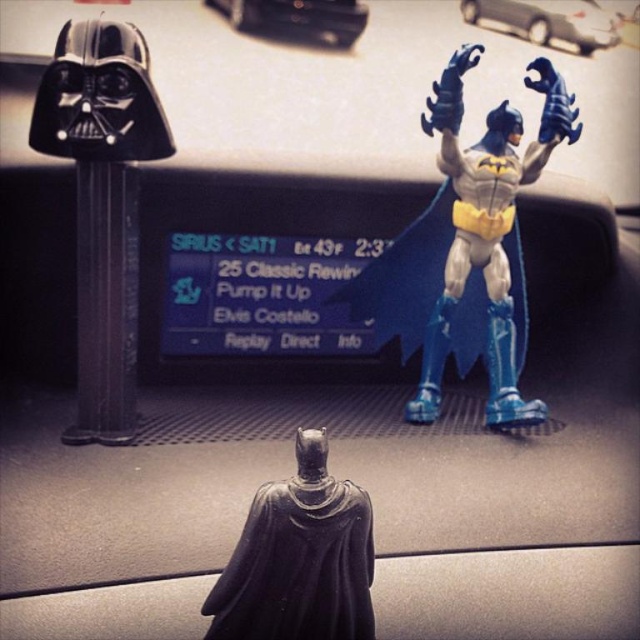
Question: Considering the real-world distances, which object is closest to the black matte darth vader head at left?

Choices:
 (A) blue plastic batman figure at upper right
 (B) black glossy statue at center

Answer: (A)

Question: Which of the following is the closest to the observer?

Choices:
 (A) black matte darth vader head at left
 (B) black glossy statue at center
 (C) blue plastic batman figure at upper right

Answer: (B)

Question: From the image, what is the correct spatial relationship of black matte darth vader head at left in relation to black glossy statue at center?

Choices:
 (A) left
 (B) right

Answer: (A)

Question: Based on their relative distances, which object is nearer to the black matte darth vader head at left?

Choices:
 (A) black glossy statue at center
 (B) blue plastic batman figure at upper right

Answer: (B)

Question: Can you confirm if blue plastic batman figure at upper right is positioned below black glossy statue at center?

Choices:
 (A) yes
 (B) no

Answer: (B)

Question: Can you confirm if blue plastic batman figure at upper right is positioned above black matte darth vader head at left?

Choices:
 (A) no
 (B) yes

Answer: (B)